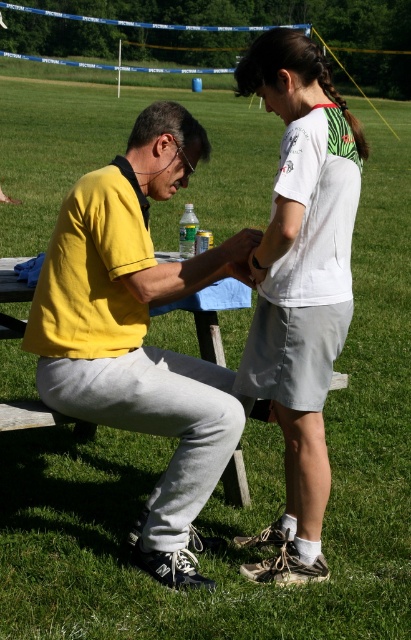
Measure the distance between point (143,157) and camera.

Point (143,157) is 3.12 meters from camera.

Is yellow matte shirt at center further to camera compared to white cotton t-shirt at upper center?

Yes, it is behind white cotton t-shirt at upper center.

The image size is (411, 640). Find the location of `yellow matte shirt at center`. yellow matte shirt at center is located at coordinates (138, 330).